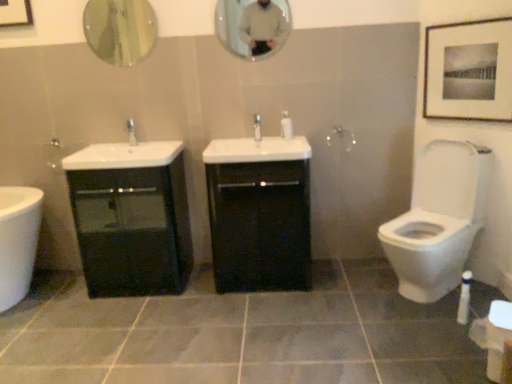
Locate an element on the screen. This screenshot has width=512, height=384. free space in front of black glossy cabinet at left, which is counted as the 1th bathroom cabinet, starting from the left is located at coordinates 118,326.